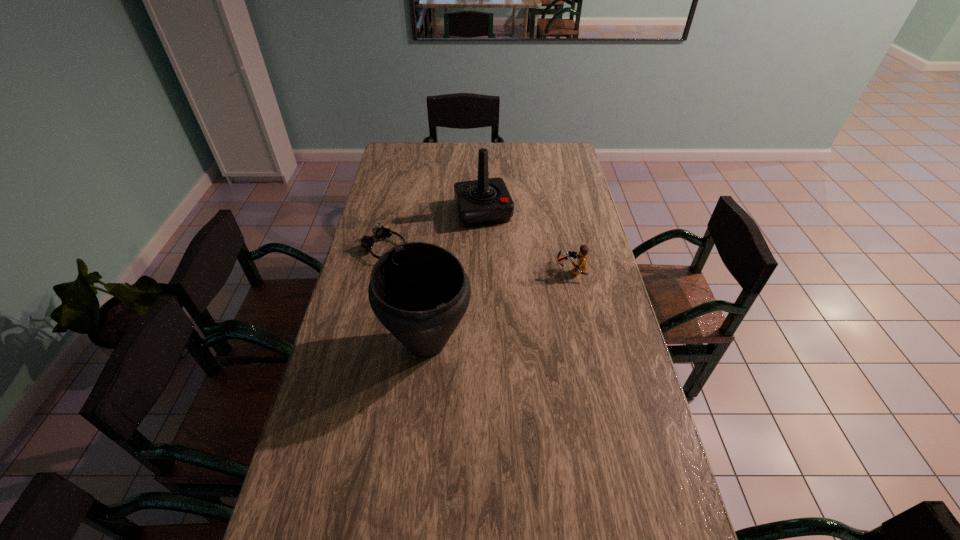
I want to click on vacant region at the left edge of the desktop, so click(x=361, y=267).

Where is `vacant space at the right edge of the desktop`? vacant space at the right edge of the desktop is located at coordinates (644, 396).

Where is `vacant region at the far right corner of the desktop`? Image resolution: width=960 pixels, height=540 pixels. vacant region at the far right corner of the desktop is located at coordinates (571, 151).

Identify the location of vacant area between the Lego and the joystick. (527, 241).

The image size is (960, 540). I want to click on vacant point located between the goggles and the farthest object, so click(x=434, y=230).

This screenshot has width=960, height=540. I want to click on vacant space in between the shortest object and the rightmost object, so click(478, 259).

The height and width of the screenshot is (540, 960). I want to click on free spot between the joystick and the shortest object, so click(x=434, y=230).

Image resolution: width=960 pixels, height=540 pixels. What are the coordinates of `free spot between the joystick and the goggles` in the screenshot? It's located at (434, 230).

Where is `vacant area that lies between the shortest object and the joystick`? The width and height of the screenshot is (960, 540). vacant area that lies between the shortest object and the joystick is located at coordinates (434, 230).

Find the location of `object that is the third closest to the rightmost object`. object that is the third closest to the rightmost object is located at coordinates (379, 232).